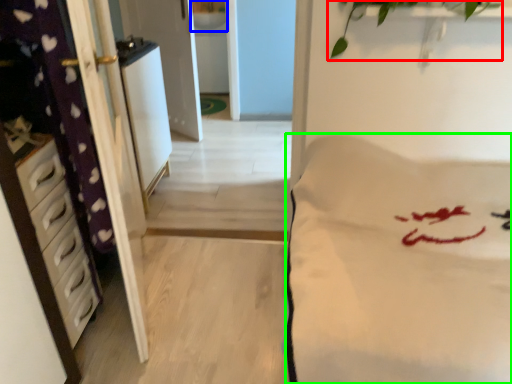
Question: Which is farther away from plant (highlighted by a red box)? sink (highlighted by a blue box) or mattress (highlighted by a green box)?

Choices:
 (A) sink
 (B) mattress

Answer: (A)